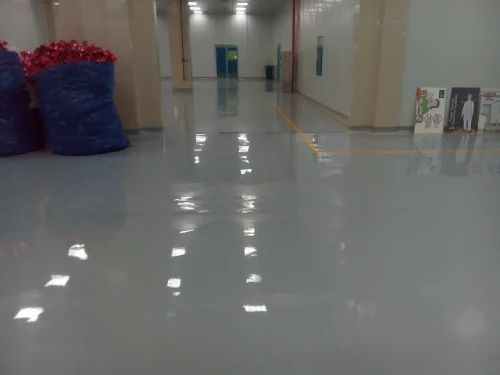
Where is `wall`? wall is located at coordinates (444, 42), (341, 22), (242, 22), (161, 37).